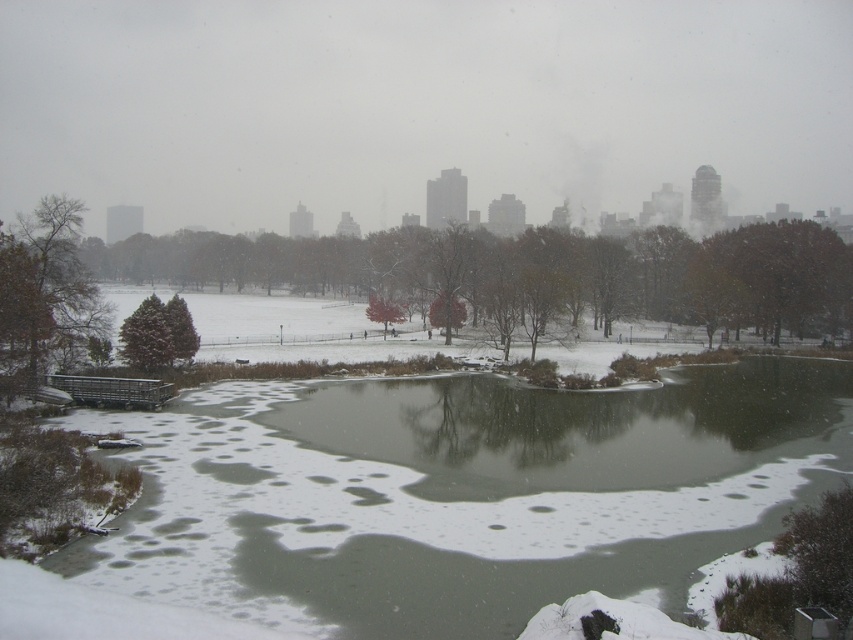
Is green matte tree at center shorter than snow-covered evergreen at center-left?

In fact, green matte tree at center may be taller than snow-covered evergreen at center-left.

Is point (468, 294) positioned in front of point (163, 364)?

No.

The image size is (853, 640). I want to click on green matte tree at center, so click(x=532, y=273).

Which is behind, point (4, 336) or point (155, 342)?

Point (155, 342)

Looking at this image, is bare branches at left shorter than snow-covered evergreen at center-left?

No.

You are a GUI agent. You are given a task and a screenshot of the screen. Output one action in this format:
    pyautogui.click(x=<x>, y=<y>)
    Task: Click on the bare branches at left
    This screenshot has width=853, height=640.
    Given the screenshot: What is the action you would take?
    pyautogui.click(x=44, y=291)

Is green matte tree at center shorter than bare branches at left?

No.

Does point (131, 257) lie behind point (3, 372)?

That is True.

This screenshot has height=640, width=853. Identify the location of green matte tree at center. coord(532,273).